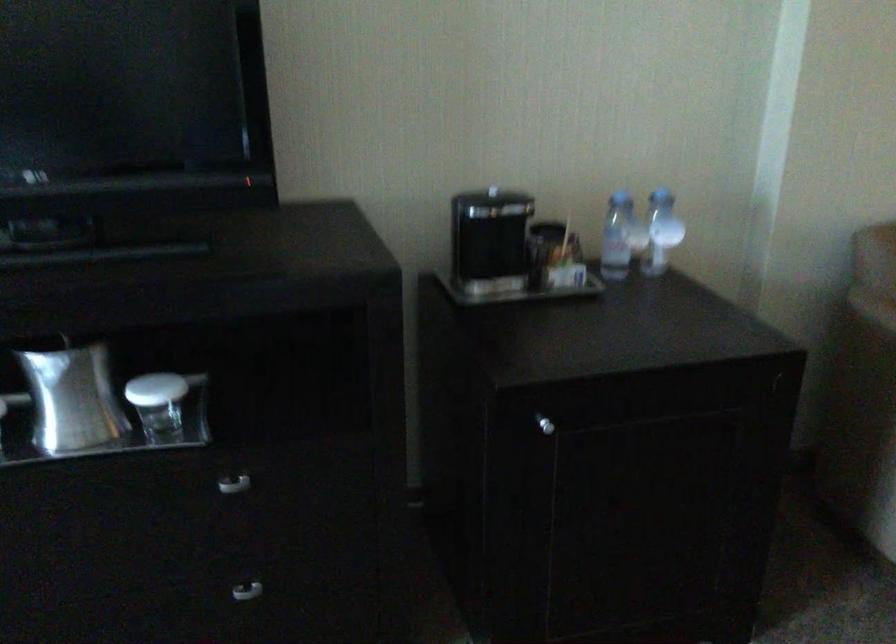
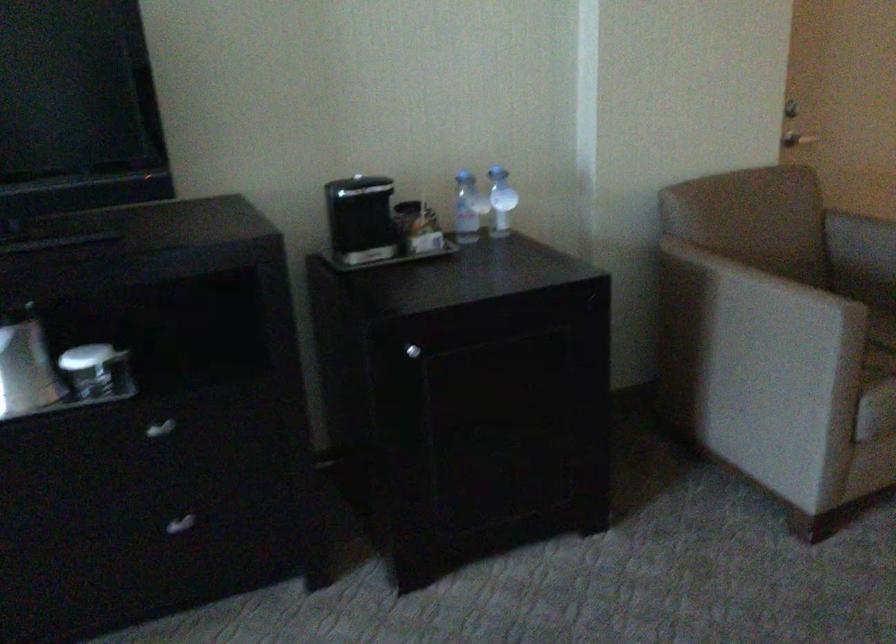
Question: The camera is either moving clockwise (left) or counter-clockwise (right) around the object. The first image is from the beginning of the video and the second image is from the end. Is the camera moving left or right when shooting the video?

Choices:
 (A) Left
 (B) Right

Answer: (A)